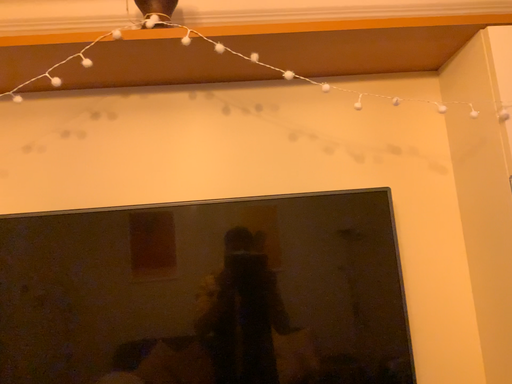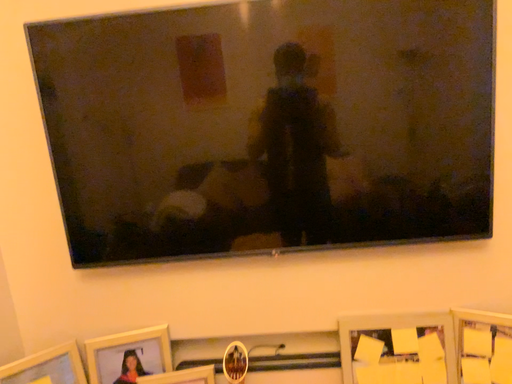
Question: How did the camera likely rotate when shooting the video?

Choices:
 (A) rotated upward
 (B) rotated downward

Answer: (B)